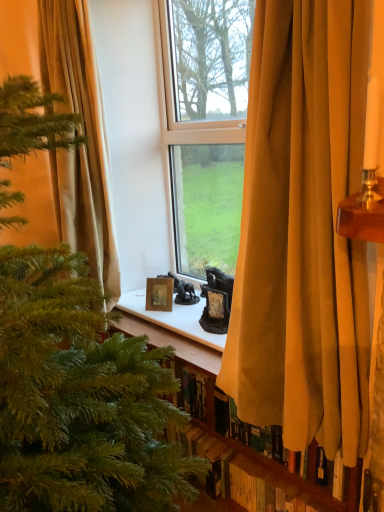
Question: Is green matte christmas tree at left spatially inside beige fabric curtain at left, placed as the 2th curtain when sorted from right to left, or outside of it?

Choices:
 (A) inside
 (B) outside

Answer: (B)

Question: From the image's perspective, relative to beige fabric curtain at left, the first curtain when ordered from left to right, is green matte christmas tree at left above or below?

Choices:
 (A) above
 (B) below

Answer: (B)

Question: Which object is positioned closest to the wooden photo frame at center?

Choices:
 (A) velvet gold curtain at center, which ranks as the 1th curtain in front-to-back order
 (B) wooden bookshelf at lower center
 (C) green matte christmas tree at left
 (D) beige fabric curtain at left, arranged as the 1th curtain when viewed from the back

Answer: (D)

Question: Which is nearer to the wooden bookshelf at lower center?

Choices:
 (A) wooden photo frame at center
 (B) velvet gold curtain at center, which is counted as the 2th curtain, starting from the left
 (C) beige fabric curtain at left, acting as the second curtain starting from the front
 (D) green matte christmas tree at left

Answer: (B)